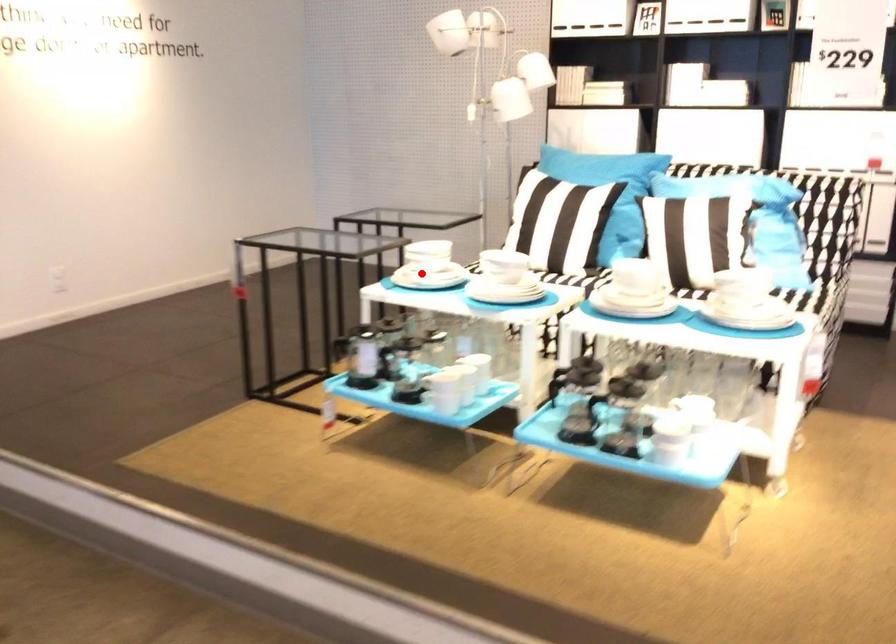
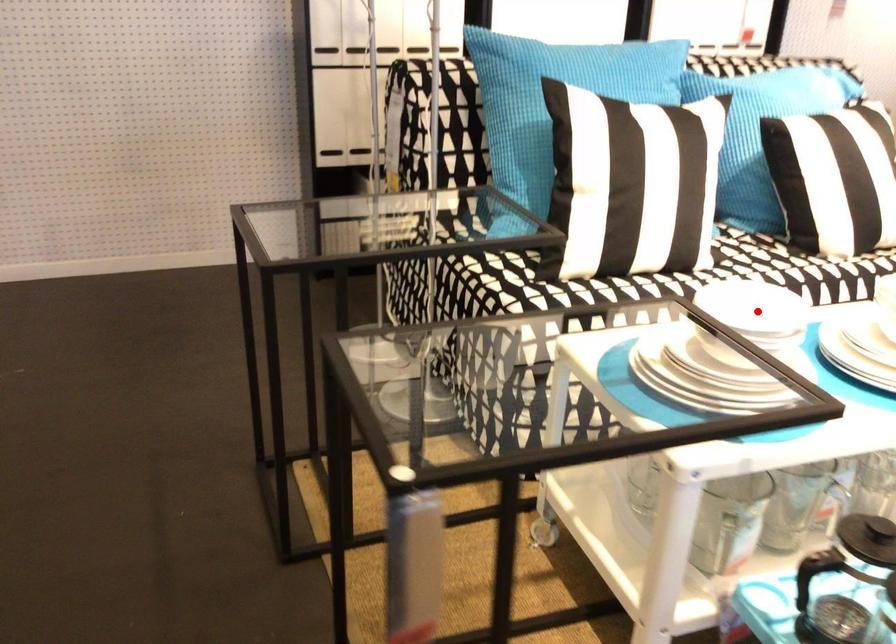
I am providing you with two images of the same scene from different viewpoints. A red point is marked on the first image and another point is marked on the second image. Are the points marked in image1 and image2 representing the same 3D position?

No